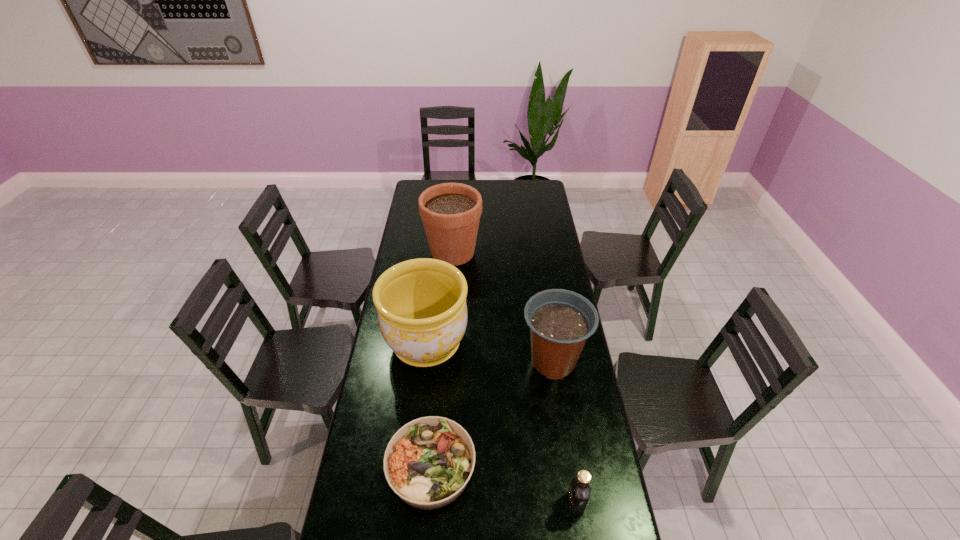
The image size is (960, 540). I want to click on free space between the farthest flowerpot and the rightmost flowerpot, so click(x=503, y=307).

This screenshot has width=960, height=540. What are the coordinates of `free spot between the second shortest object and the salad plate` in the screenshot? It's located at (503, 485).

This screenshot has height=540, width=960. In order to click on vacant space that is in between the vodka and the farthest object in this screenshot , I will do `click(515, 377)`.

Locate an element on the screen. The width and height of the screenshot is (960, 540). vacant region between the second shortest object and the salad plate is located at coordinates (503, 485).

Find the location of a particular element. This screenshot has width=960, height=540. the second closest object relative to the salad plate is located at coordinates (560, 321).

I want to click on the second closest object to the third shortest object, so click(x=428, y=462).

Identify the location of the closest flowerpot relative to the shortest object. (422, 312).

Locate an element on the screen. The height and width of the screenshot is (540, 960). flowerpot that is the third closest to the vodka is located at coordinates (450, 212).

You are a GUI agent. You are given a task and a screenshot of the screen. Output one action in this format:
    pyautogui.click(x=<x>, y=<y>)
    Task: Click on the free point that satisfies the following two spatial constraints: 1. on the front side of the third tallest object; 2. on the left side of the farthest flowerpot
    Image resolution: width=960 pixels, height=540 pixels.
    Given the screenshot: What is the action you would take?
    point(445,361)